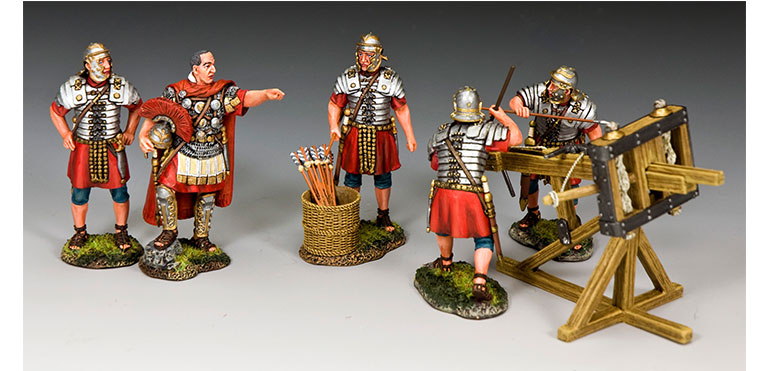
Locate an element on the screen. basket is located at coordinates (320, 226).